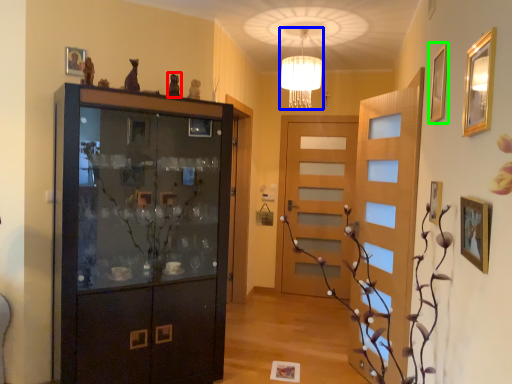
Question: Which object is the farthest from art (highlighted by a red box)? Choose among these: lamp (highlighted by a blue box) or picture frame (highlighted by a green box).

Choices:
 (A) lamp
 (B) picture frame

Answer: (B)